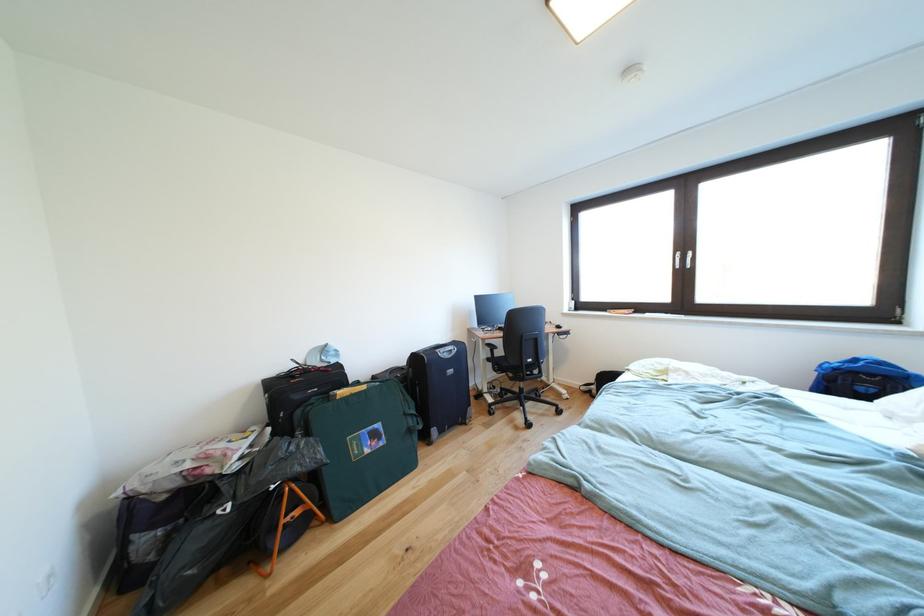
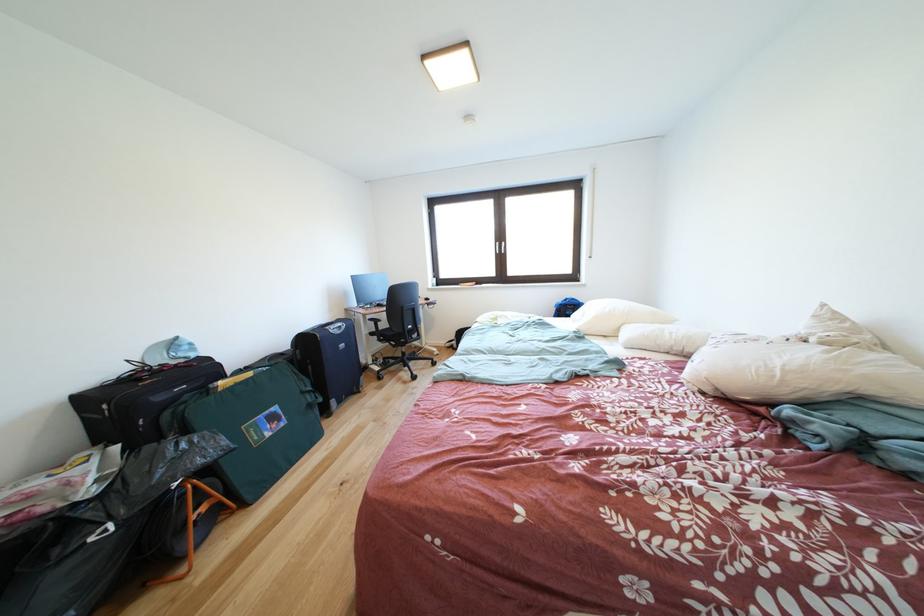
Where in the second image is the point corresponding to point (519, 384) from the first image?

(403, 351)